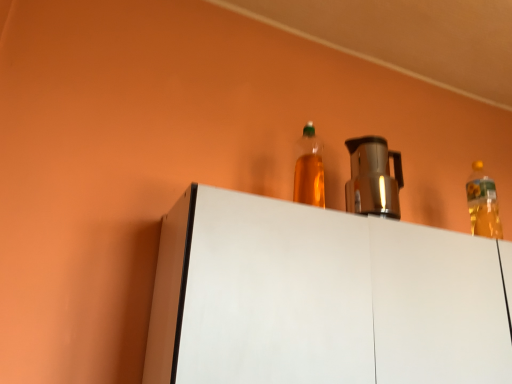
Question: From a real-world perspective, is translucent plastic bottle at upper center, placed as the second bottle when sorted from right to left, located beneath white matte cabinet at upper center?

Choices:
 (A) yes
 (B) no

Answer: (B)

Question: Does translucent plastic bottle at upper center, the 2th bottle viewed from the back, contain white matte cabinet at upper center?

Choices:
 (A) yes
 (B) no

Answer: (B)

Question: Is translucent plastic bottle at upper center, the first bottle in the left-to-right sequence, in contact with white matte cabinet at upper center?

Choices:
 (A) no
 (B) yes

Answer: (A)

Question: Is translucent plastic bottle at upper center, placed as the second bottle when sorted from right to left, completely or partially outside of white matte cabinet at upper center?

Choices:
 (A) no
 (B) yes

Answer: (B)

Question: Does translucent plastic bottle at upper center, the first bottle in the left-to-right sequence, have a greater height compared to white matte cabinet at upper center?

Choices:
 (A) no
 (B) yes

Answer: (A)

Question: Considering the relative positions of metallic silver coffee pot at center and white matte cabinet at upper center in the image provided, is metallic silver coffee pot at center to the left or to the right of white matte cabinet at upper center?

Choices:
 (A) right
 (B) left

Answer: (B)

Question: Considering the positions of metallic silver coffee pot at center and white matte cabinet at upper center in the image, is metallic silver coffee pot at center bigger or smaller than white matte cabinet at upper center?

Choices:
 (A) small
 (B) big

Answer: (A)

Question: Is metallic silver coffee pot at center in front of or behind white matte cabinet at upper center in the image?

Choices:
 (A) front
 (B) behind

Answer: (B)

Question: From a real-world perspective, relative to white matte cabinet at upper center, is metallic silver coffee pot at center vertically above or below?

Choices:
 (A) above
 (B) below

Answer: (A)

Question: Would you say translucent yellow bottle at upper right, acting as the first bottle starting from the right, is to the left or to the right of white matte cabinet at upper center in the picture?

Choices:
 (A) right
 (B) left

Answer: (A)

Question: From their relative heights in the image, would you say translucent yellow bottle at upper right, which is the 2th bottle in left-to-right order, is taller or shorter than white matte cabinet at upper center?

Choices:
 (A) short
 (B) tall

Answer: (A)

Question: Considering their positions, is translucent yellow bottle at upper right, acting as the first bottle starting from the right, located in front of or behind white matte cabinet at upper center?

Choices:
 (A) behind
 (B) front

Answer: (A)

Question: Considering the positions of translucent yellow bottle at upper right, acting as the first bottle starting from the right, and white matte cabinet at upper center in the image, is translucent yellow bottle at upper right, acting as the first bottle starting from the right, bigger or smaller than white matte cabinet at upper center?

Choices:
 (A) small
 (B) big

Answer: (A)

Question: Is metallic silver coffee pot at center bigger or smaller than translucent yellow bottle at upper right, the 1th bottle viewed from the back?

Choices:
 (A) big
 (B) small

Answer: (A)

Question: Considering the positions of metallic silver coffee pot at center and translucent yellow bottle at upper right, the second bottle positioned from the front, in the image, is metallic silver coffee pot at center wider or thinner than translucent yellow bottle at upper right, the second bottle positioned from the front,?

Choices:
 (A) wide
 (B) thin

Answer: (A)